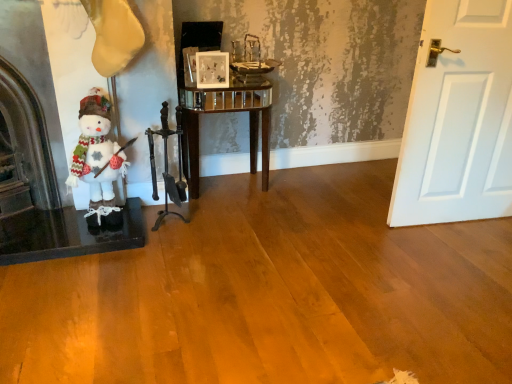
Find the location of `vacant space in front of white fabric snowman at left`. vacant space in front of white fabric snowman at left is located at coordinates (90, 264).